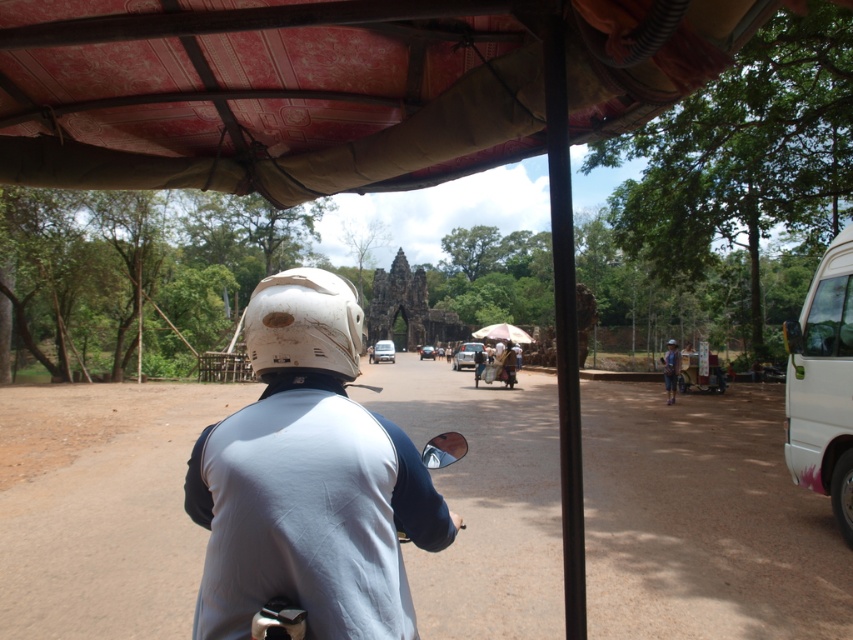
Consider the image. Is white matte van at right to the right of silver metallic van at center from the viewer's perspective?

Yes, white matte van at right is to the right of silver metallic van at center.

Looking at this image, who is positioned more to the right, white matte van at right or silver metallic van at center?

From the viewer's perspective, white matte van at right appears more on the right side.

Is point (804, 467) closer to viewer compared to point (390, 344)?

Yes.

This screenshot has height=640, width=853. I want to click on white matte van at right, so click(822, 384).

Based on the photo, does white matte helmet at center have a greater height compared to silver metallic van at center?

No, white matte helmet at center is not taller than silver metallic van at center.

What do you see at coordinates (309, 480) in the screenshot? I see `white matte helmet at center` at bounding box center [309, 480].

Is point (322, 524) behind point (381, 355)?

No, it is in front of (381, 355).

Find the location of `white matte helmet at center`. white matte helmet at center is located at coordinates (309, 480).

Who is higher up, brown dirt track at center or white matte helmet at center?

Positioned higher is white matte helmet at center.

Between brown dirt track at center and white matte helmet at center, which one is positioned lower?

brown dirt track at center is lower down.

Which is behind, point (503, 472) or point (328, 541)?

The point (503, 472) is more distant.

You are a GUI agent. You are given a task and a screenshot of the screen. Output one action in this format:
    pyautogui.click(x=<x>, y=<y>)
    Task: Click on the brown dirt track at center
    
    Given the screenshot: What is the action you would take?
    pyautogui.click(x=703, y=520)